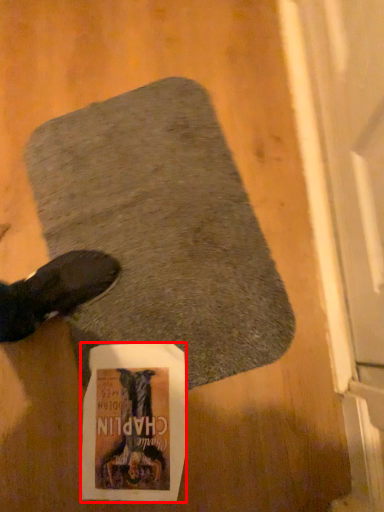
Question: From the image's perspective, where is flyer (annotated by the red box) located in relation to mat in the image?

Choices:
 (A) below
 (B) above

Answer: (A)